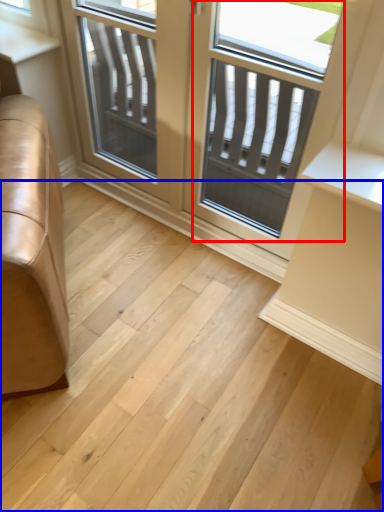
Question: Which of the following is the closest to the observer, screen door (highlighted by a red box) or stairwell (highlighted by a blue box)?

Choices:
 (A) screen door
 (B) stairwell

Answer: (B)